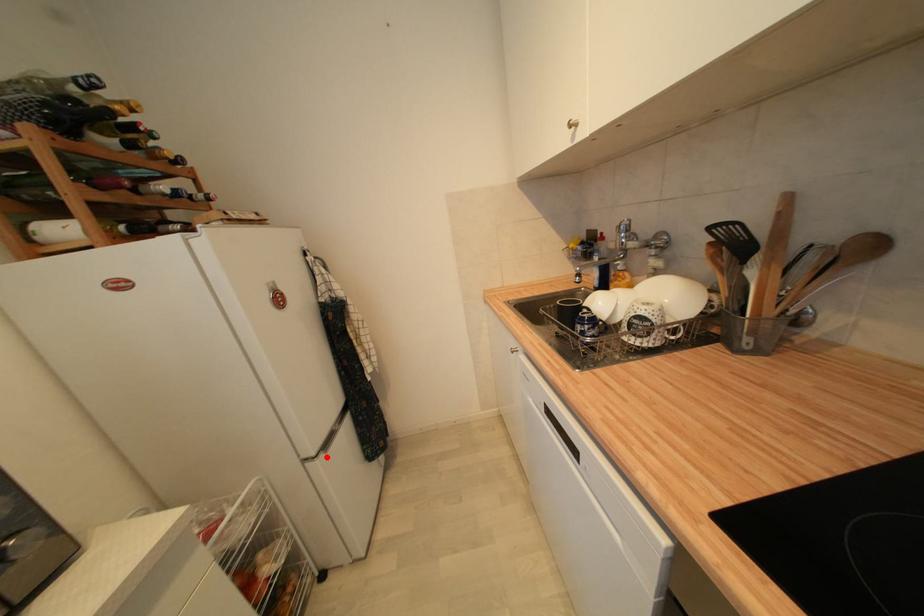
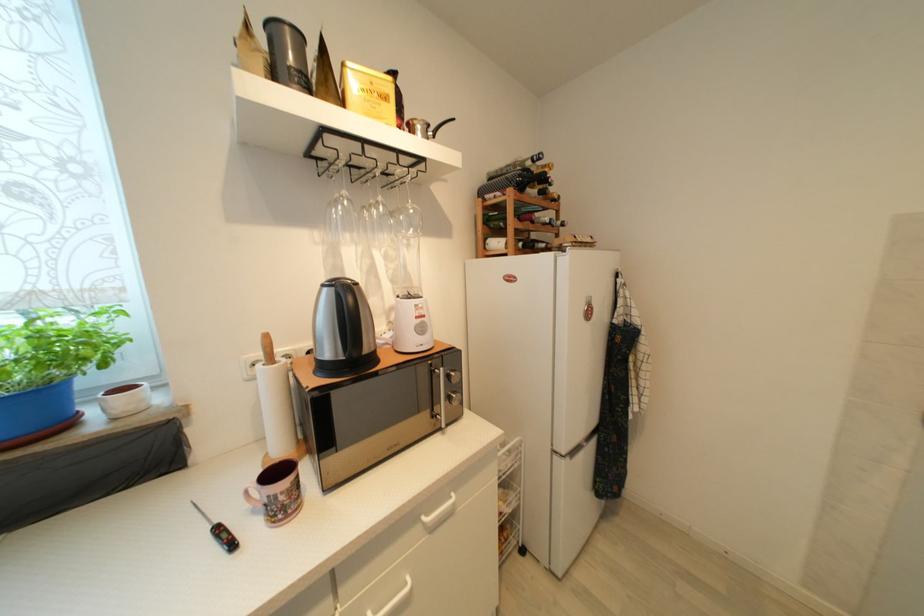
Question: I am providing you with two images of the same scene from different viewpoints. Given a red point in image1, look at the same physical point in image2. Is it:

Choices:
 (A) Closer to the viewpoint
 (B) Farther from the viewpoint

Answer: (B)